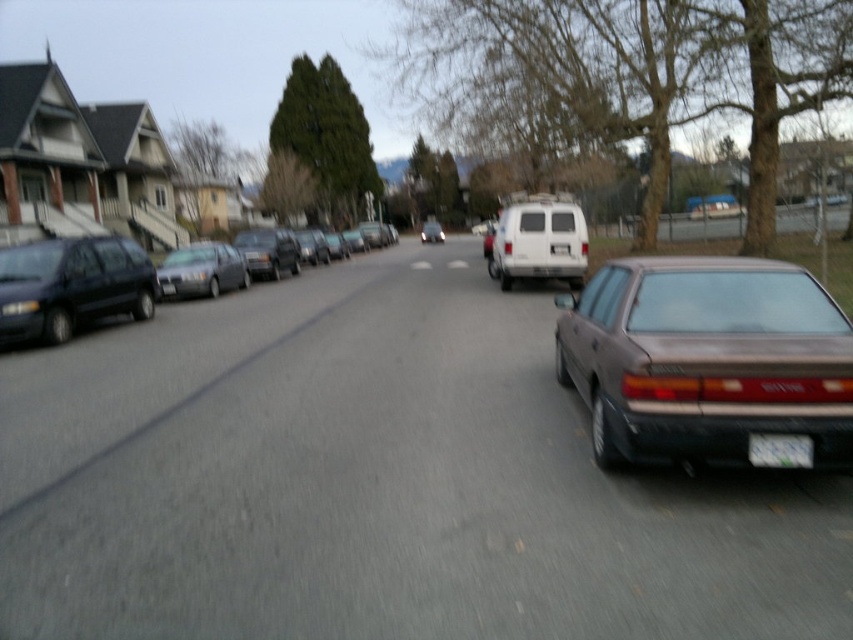
Question: Which point is farther from the camera taking this photo?

Choices:
 (A) (440, 234)
 (B) (495, 260)
 (C) (273, 228)
 (D) (80, 317)

Answer: (A)

Question: Where is satin silver sedan at left located in relation to matte gray suv at center in the image?

Choices:
 (A) left
 (B) right

Answer: (A)

Question: Which of these objects is positioned closest to the white matte van at center?

Choices:
 (A) white plastic license plate at center
 (B) brown matte sedan at center

Answer: (B)

Question: Which point is farther to the camera?

Choices:
 (A) white matte van at center
 (B) white plastic license plate at center

Answer: (A)

Question: Is matte black minivan at left thinner than shiny silver sedan at center?

Choices:
 (A) no
 (B) yes

Answer: (B)

Question: Can you confirm if white matte van at center is positioned to the left of white plastic license plate at center?

Choices:
 (A) no
 (B) yes

Answer: (A)